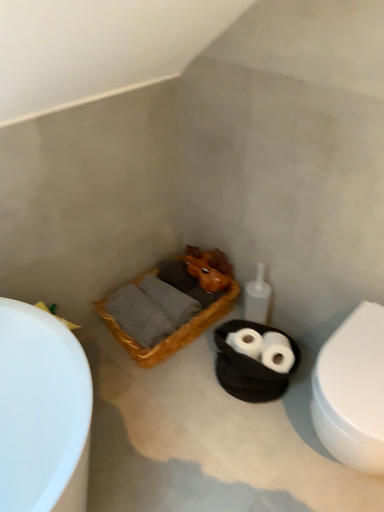
What are the coordinates of `vacant space in between white glossy bathtub at left and black woven basket at center` in the screenshot? It's located at (164, 392).